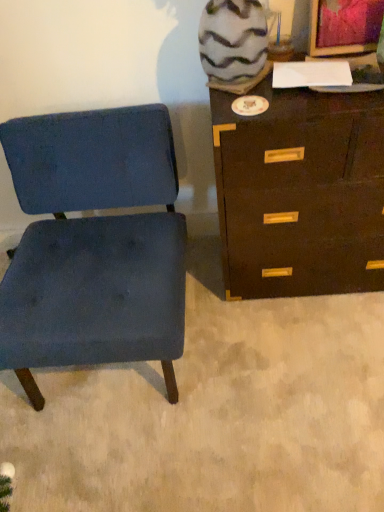
This screenshot has height=512, width=384. Identify the location of free space in front of blue fabric chair at left. (148, 455).